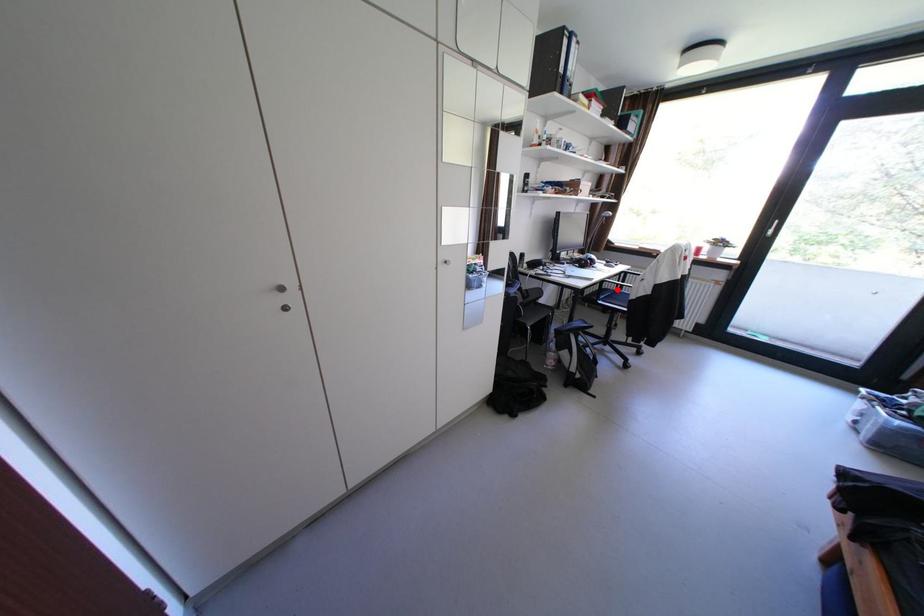
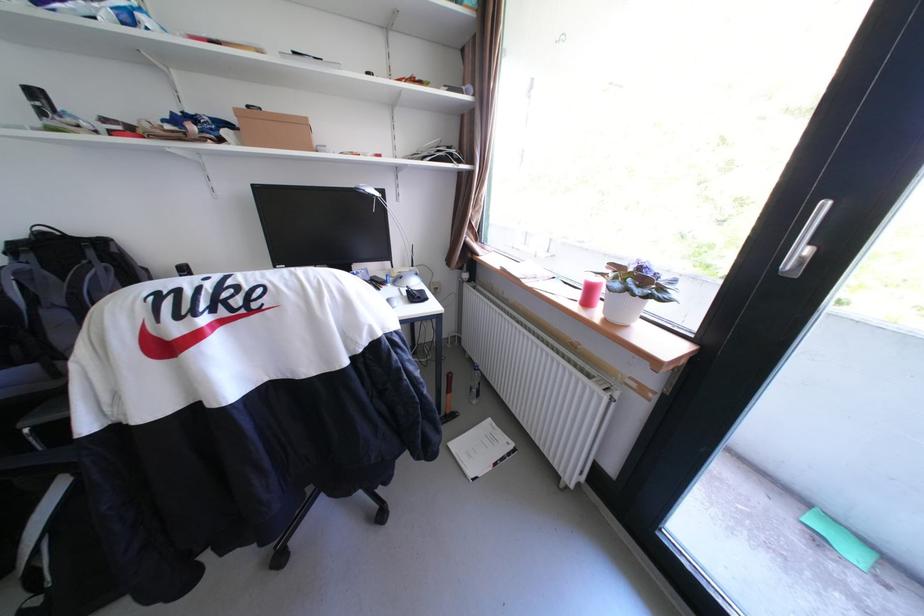
Question: I am providing you with two images of the same scene from different viewpoints. A red point is marked on the first image. Is the red point's position out of view in image 2?

Choices:
 (A) Yes
 (B) No

Answer: (A)